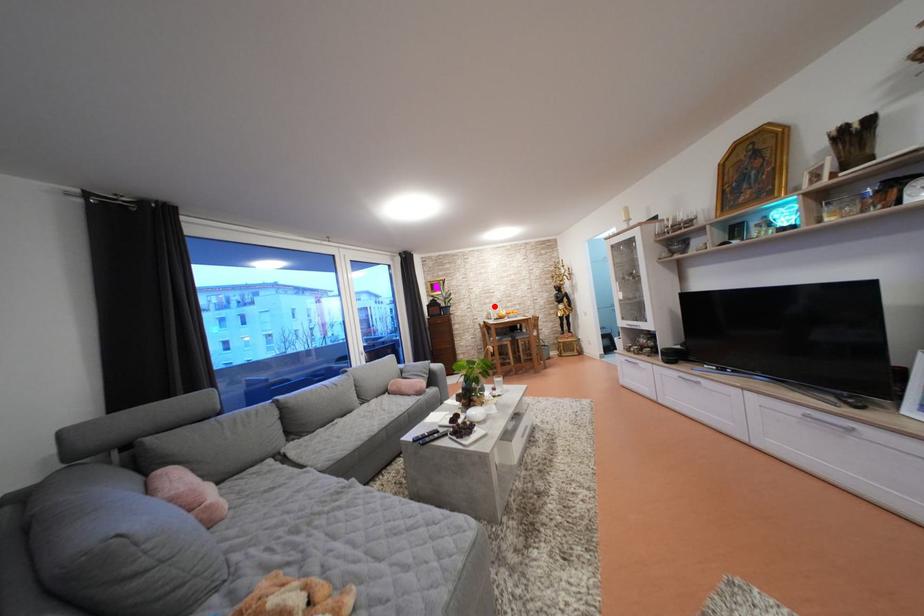
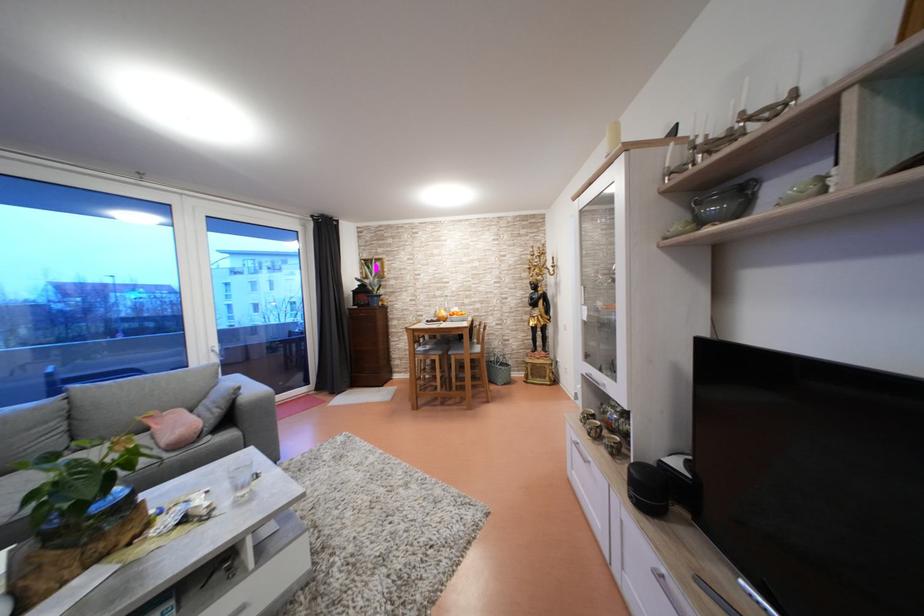
Locate, in the second image, the point that corresponds to the highlighted location in the first image.

(444, 299)